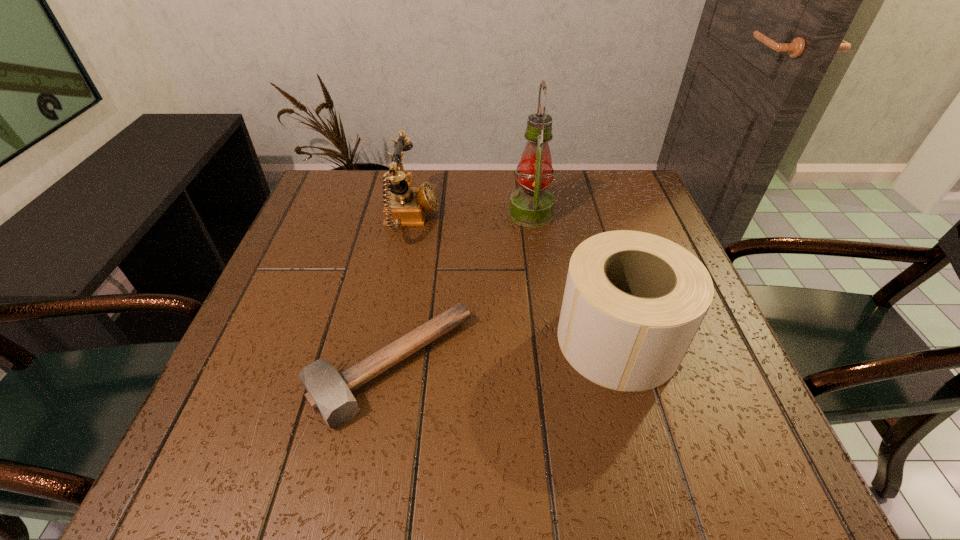
The image size is (960, 540). What are the coordinates of `free region that satisfies the following two spatial constraints: 1. on the dial number of the telephone; 2. on the back side of the shortest object` in the screenshot? It's located at (384, 367).

The height and width of the screenshot is (540, 960). Find the location of `free point that satisfies the following two spatial constraints: 1. on the front side of the tallest object; 2. on the dial number of the telephone`. free point that satisfies the following two spatial constraints: 1. on the front side of the tallest object; 2. on the dial number of the telephone is located at coordinates (532, 220).

The width and height of the screenshot is (960, 540). I want to click on free space that satisfies the following two spatial constraints: 1. on the dial number of the telephone; 2. on the back side of the shortest object, so click(384, 367).

This screenshot has height=540, width=960. I want to click on free space that satisfies the following two spatial constraints: 1. on the dial number of the telephone; 2. on the back side of the mallet, so click(x=384, y=367).

Locate an element on the screen. free spot that satisfies the following two spatial constraints: 1. on the back side of the mallet; 2. on the right side of the oil lamp is located at coordinates (418, 213).

I want to click on vacant area that satisfies the following two spatial constraints: 1. on the dial number of the telephone; 2. on the right side of the mallet, so click(x=384, y=367).

Find the location of a particular element. The image size is (960, 540). free spot that satisfies the following two spatial constraints: 1. on the front side of the tallest object; 2. on the dial number of the telephone is located at coordinates (532, 220).